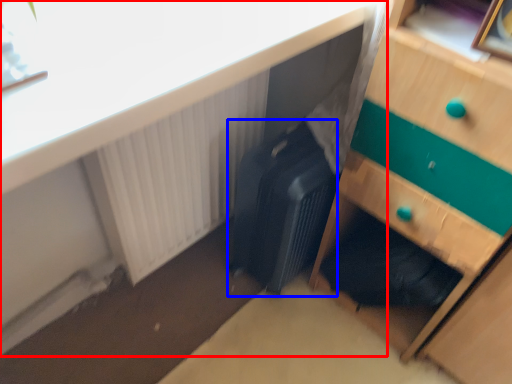
Question: Among these objects, which one is nearest to the camera, desk (highlighted by a red box) or luggage (highlighted by a blue box)?

Choices:
 (A) desk
 (B) luggage

Answer: (A)